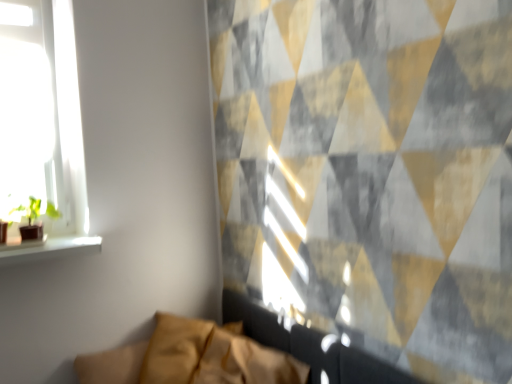
Question: Looking at their shapes, would you say leather-like tan couch at lower center is wider or thinner than green matte houseplant at left?

Choices:
 (A) wide
 (B) thin

Answer: (A)

Question: Would you say leather-like tan couch at lower center is inside or outside green matte houseplant at left?

Choices:
 (A) outside
 (B) inside

Answer: (A)

Question: From the image's perspective, is leather-like tan couch at lower center positioned above or below green matte houseplant at left?

Choices:
 (A) below
 (B) above

Answer: (A)

Question: Considering the positions of green matte houseplant at left and leather-like tan couch at lower center in the image, is green matte houseplant at left bigger or smaller than leather-like tan couch at lower center?

Choices:
 (A) big
 (B) small

Answer: (B)

Question: Is green matte houseplant at left taller or shorter than leather-like tan couch at lower center?

Choices:
 (A) short
 (B) tall

Answer: (A)

Question: In terms of width, does green matte houseplant at left look wider or thinner when compared to leather-like tan couch at lower center?

Choices:
 (A) wide
 (B) thin

Answer: (B)

Question: Considering the relative positions of green matte houseplant at left and leather-like tan couch at lower center in the image provided, is green matte houseplant at left to the left or to the right of leather-like tan couch at lower center?

Choices:
 (A) left
 (B) right

Answer: (A)